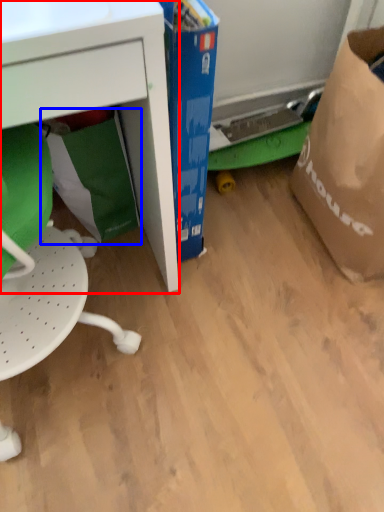
Question: Which object appears farthest to the camera in this image, desk (highlighted by a red box) or grocery bag (highlighted by a blue box)?

Choices:
 (A) desk
 (B) grocery bag

Answer: (B)